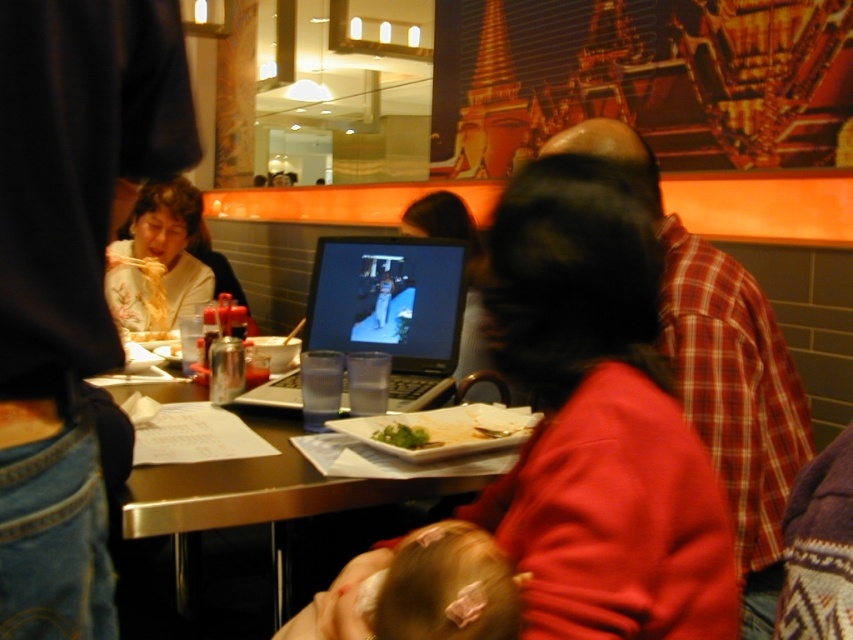
You are a customer at the restaurant and want to place your phone on the table. The phone has a length of 15 cm. The table has a rectangular shape with a length of 60 cm and a width of 40 cm. The matte black laptop at left is placed at point 0.434, 0.082 on the table. If you want to place your phone horizontally along the length of the table without overlapping the laptop, what is the maximum length available for placing the phone?

The maximum length available for placing the phone horizontally along the length of the table without overlapping the matte black laptop at left is 60 cm minus the space occupied by the laptop. However, since the exact dimensions of the laptop are not provided, we can only confirm that there is sufficient space along the length of the table to accommodate the 15 cm phone.

You are a customer at the restaurant and want to place your phone on the table. The table has a matte black laptop at left. Where on the table should you place your phone so it doesn not block the laptop?

Place the phone away from the matte black laptop at left, preferably on the opposite side of the table since the laptop is located at point (68,276).

You are a server at the restaurant and need to place a new drink order on the table. The matte red sweater at center is currently on the metallic table at center. Where should you place the drink to avoid disturbing the sweater?

The matte red sweater at center is above the metallic table at center, so you should place the drink on the table surface below the sweater to avoid disturbing it.